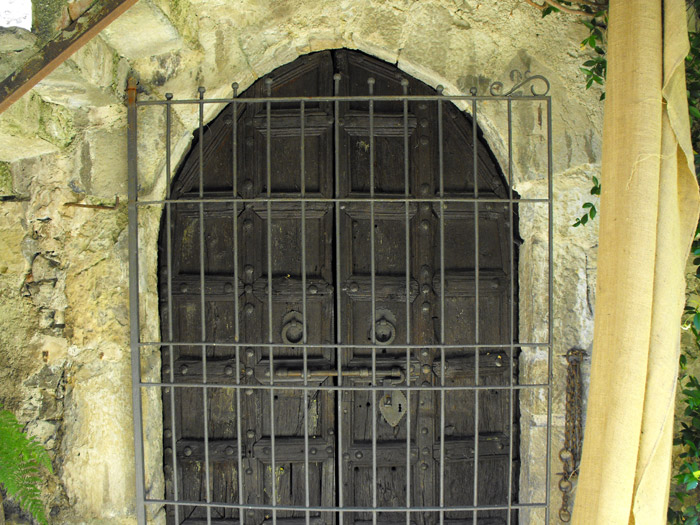
The height and width of the screenshot is (525, 700). I want to click on tannish fabric, looks somewhat like muslin or a thick cotton, so click(628, 233).